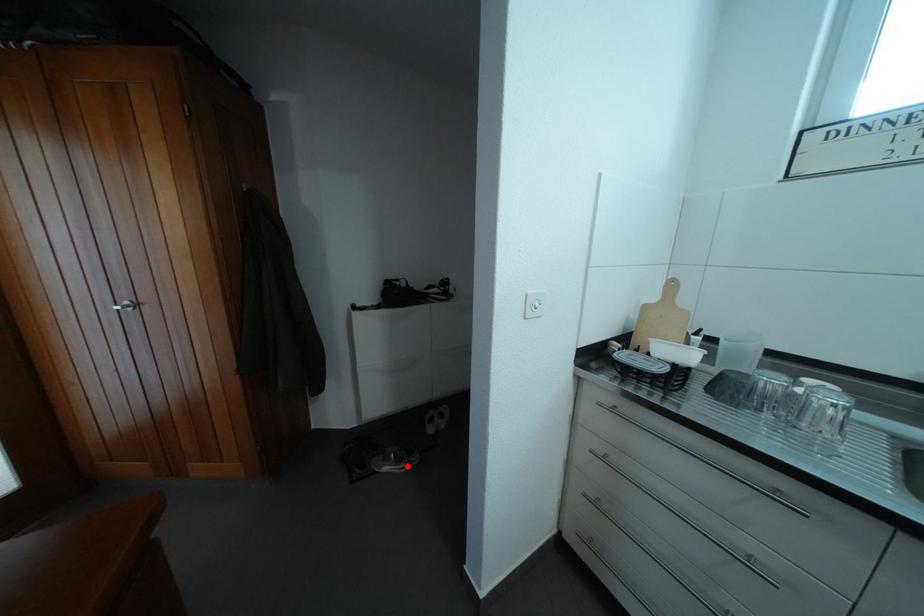
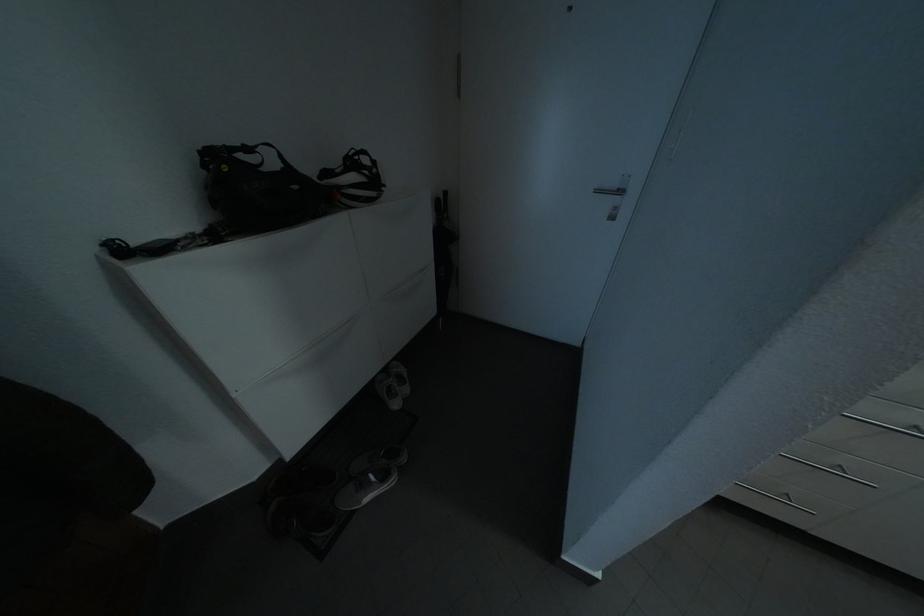
Find the pixel in the second image that matches the highlighted location in the first image.

(393, 483)